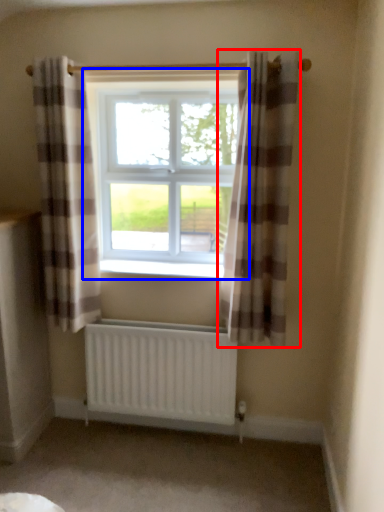
Question: Which object appears farthest to the camera in this image, curtain (highlighted by a red box) or window (highlighted by a blue box)?

Choices:
 (A) curtain
 (B) window

Answer: (B)